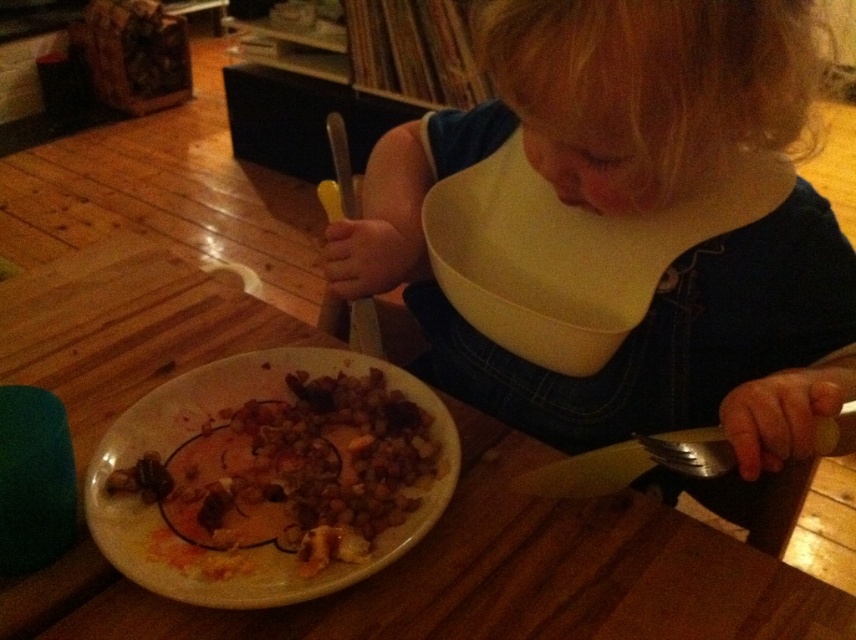
Question: Which object is closer to the camera taking this photo?

Choices:
 (A) yellow bib at upper center
 (B) wooden table at center
 (C) brown crumbly food at plate center

Answer: (A)

Question: Can you confirm if wooden table at center is thinner than silver metallic fork at lower right?

Choices:
 (A) yes
 (B) no

Answer: (B)

Question: Can you confirm if yellow bib at upper center is positioned above silver metallic fork at lower right?

Choices:
 (A) yes
 (B) no

Answer: (A)

Question: Estimate the real-world distances between objects in this image. Which object is farther from the brown crumbly food at plate center?

Choices:
 (A) yellow bib at upper center
 (B) wooden table at center

Answer: (A)

Question: Among these objects, which one is nearest to the camera?

Choices:
 (A) wooden table at center
 (B) brown crumbly food at plate center
 (C) yellow bib at upper center

Answer: (C)

Question: Is wooden table at center thinner than brown crumbly food at plate center?

Choices:
 (A) no
 (B) yes

Answer: (A)